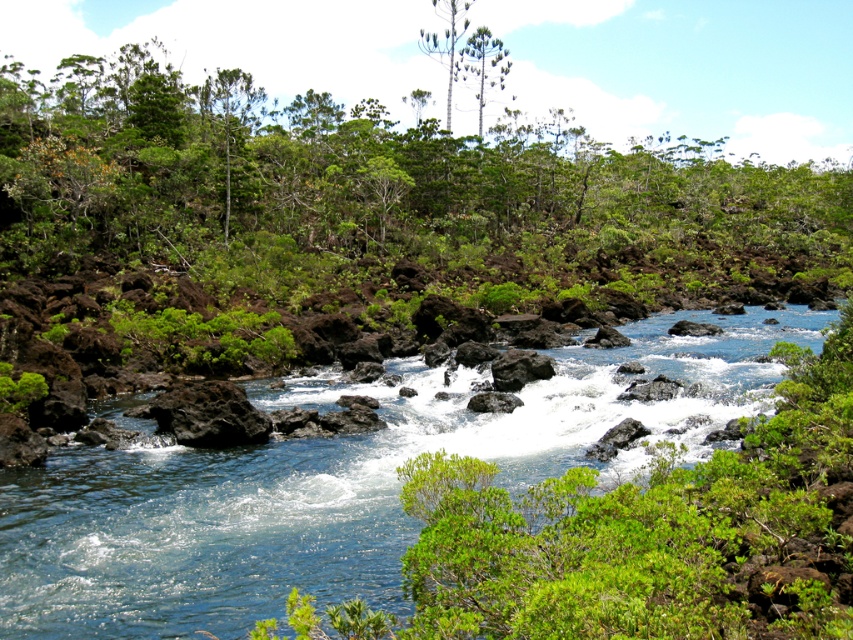
Question: Which point is farther from the camera taking this photo?

Choices:
 (A) (434, 1)
 (B) (479, 100)
 (C) (165, 467)

Answer: (B)

Question: Is clear blue water at center positioned at the back of white smooth tree at upper center?

Choices:
 (A) no
 (B) yes

Answer: (A)

Question: Is clear blue water at center positioned behind green textured tree at upper center?

Choices:
 (A) no
 (B) yes

Answer: (A)

Question: Which object is closer to the camera taking this photo?

Choices:
 (A) green textured tree at upper center
 (B) white smooth tree at upper center

Answer: (A)

Question: Is green textured tree at upper center positioned in front of white smooth tree at upper center?

Choices:
 (A) yes
 (B) no

Answer: (A)

Question: Among these objects, which one is farthest from the camera?

Choices:
 (A) white smooth tree at upper center
 (B) green textured tree at upper center
 (C) clear blue water at center

Answer: (A)